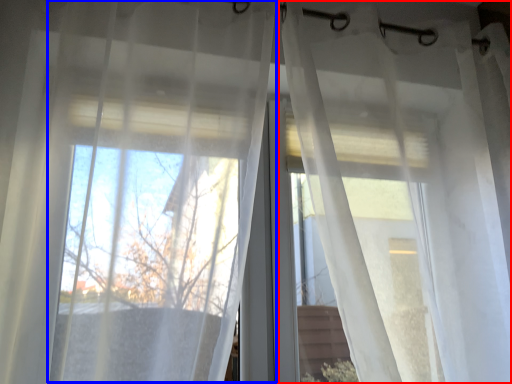
Question: Among these objects, which one is nearest to the camera, curtain (highlighted by a red box) or curtain (highlighted by a blue box)?

Choices:
 (A) curtain
 (B) curtain

Answer: (B)